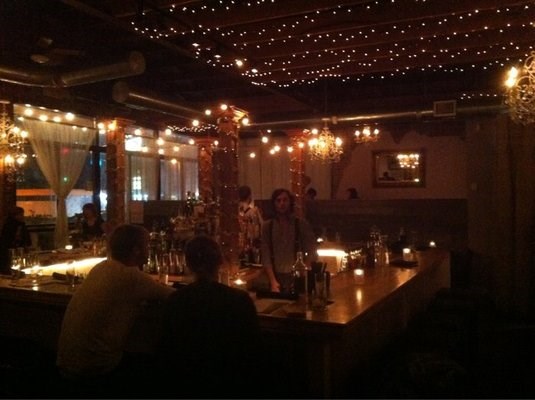
What are the coordinates of `glass bottle by people at bar` in the screenshot? It's located at (299, 282).